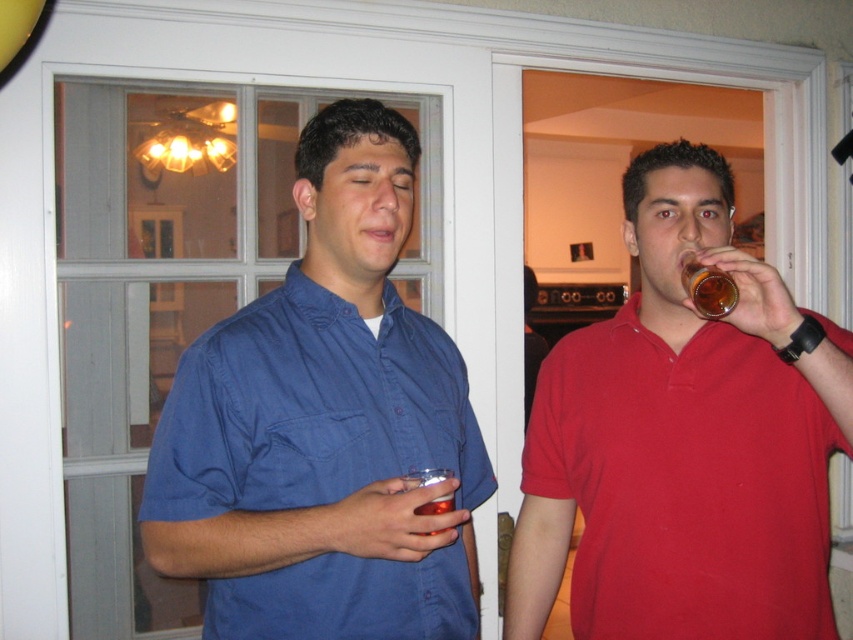
Question: Which point is closer to the camera taking this photo?

Choices:
 (A) (723, 273)
 (B) (637, 406)

Answer: (A)

Question: Is translucent amber glass at upper right below translucent plastic cup at center?

Choices:
 (A) yes
 (B) no

Answer: (B)

Question: Which point is closer to the camera taking this photo?

Choices:
 (A) (535, 625)
 (B) (717, 284)
 (C) (254, 406)
 (D) (434, 531)

Answer: (D)

Question: Does blue cotton shirt at center have a larger size compared to translucent amber glass at upper right?

Choices:
 (A) yes
 (B) no

Answer: (A)

Question: Can you confirm if matte red polo shirt at right is positioned below translucent amber glass at upper right?

Choices:
 (A) yes
 (B) no

Answer: (A)

Question: Among these points, which one is farthest from the camera?

Choices:
 (A) (680, 316)
 (B) (321, 368)
 (C) (732, 304)

Answer: (A)